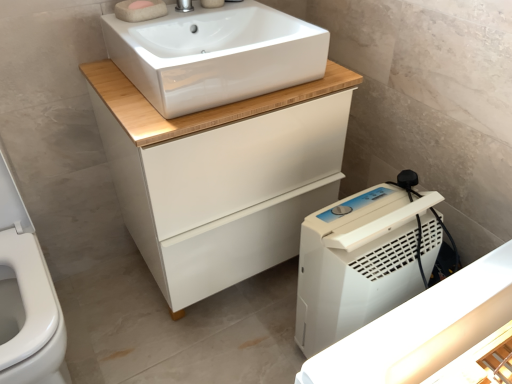
Question: Would you say white matte cabinet at center is to the left or to the right of silver metallic tap at upper center in the picture?

Choices:
 (A) right
 (B) left

Answer: (A)

Question: From the image's perspective, is white matte cabinet at center above or below silver metallic tap at upper center?

Choices:
 (A) above
 (B) below

Answer: (B)

Question: Based on their relative distances, which object is nearer to the pink sponge at upper center?

Choices:
 (A) white plastic dehumidifier at lower right
 (B) silver metallic tap at upper center
 (C) white matte cabinet at center
 (D) white glossy sink at upper center

Answer: (B)

Question: Which object is the closest to the white plastic dehumidifier at lower right?

Choices:
 (A) silver metallic tap at upper center
 (B) white glossy sink at upper center
 (C) pink sponge at upper center
 (D) white matte cabinet at center

Answer: (D)